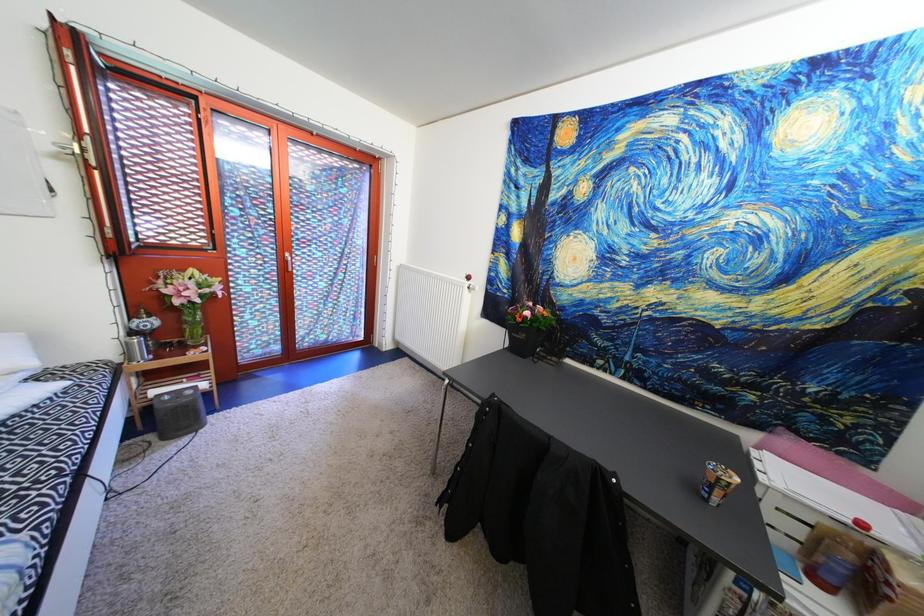
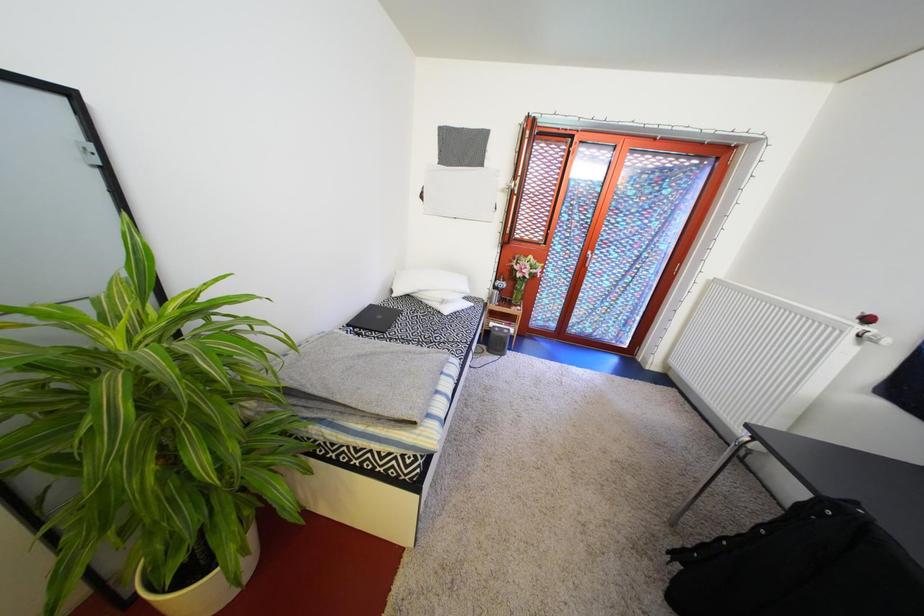
Question: The first image is from the beginning of the video and the second image is from the end. How did the camera likely rotate when shooting the video?

Choices:
 (A) Left
 (B) Right
 (C) Up
 (D) Down

Answer: (A)